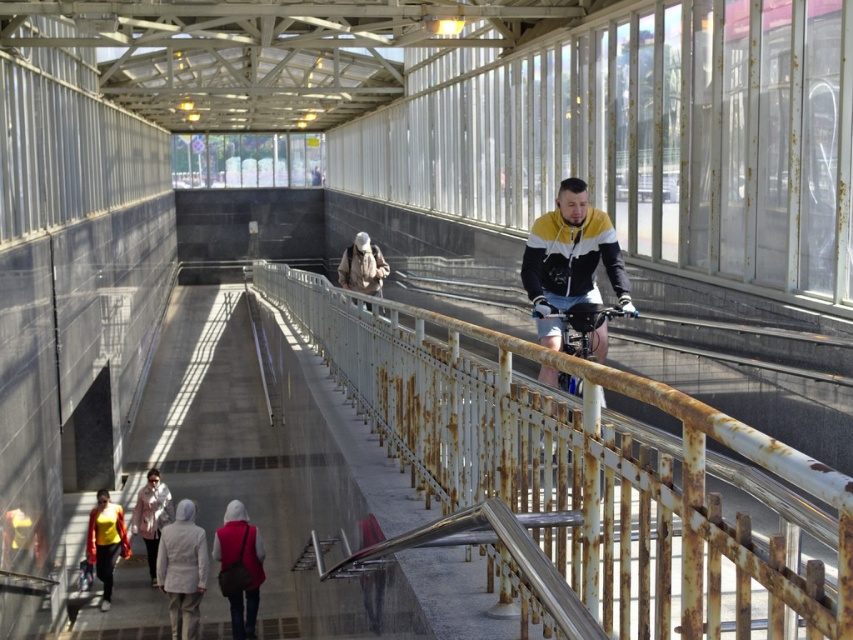
You are a delivery person carrying a large box that is 1 meter in length. You need to walk across the bridge and pass through a narrow section between the rusty metal railing at center and the camouflage fabric backpack at center. Can your box fit through the space between them?

The rusty metal railing at center is bigger than the camouflage fabric backpack at center. Since the box is 1 meter long, it may not fit through the narrow space between them if the distance is less than 1 meter. However, the exact dimensions aren

You are a fashion designer observing the bridge scene. You need to determine which jacket, the light gray fabric jacket at lower center or the white matte jacket at lower left, would be more suitable for a tall model. Based on the scene, which jacket would you recommend?

The light gray fabric jacket at lower center has a greater height compared to the white matte jacket at lower left, so it would be more suitable for a tall model as it provides a better proportion.

You are standing on the bridge and want to take a photo of the yellow fabric jacket at lower left without including the rusty metal railing at center in the frame. Is the railing likely to block your view of the jacket?

The rusty metal railing at center is much taller than the yellow fabric jacket at lower left, so it might block the view of the jacket if positioned between them.